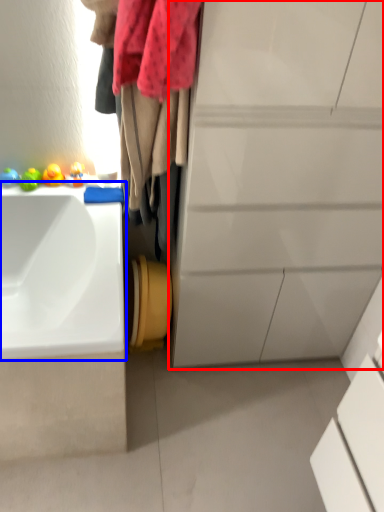
Question: Which object appears closest to the camera in this image, bathroom cabinet (highlighted by a red box) or sink (highlighted by a blue box)?

Choices:
 (A) bathroom cabinet
 (B) sink

Answer: (A)